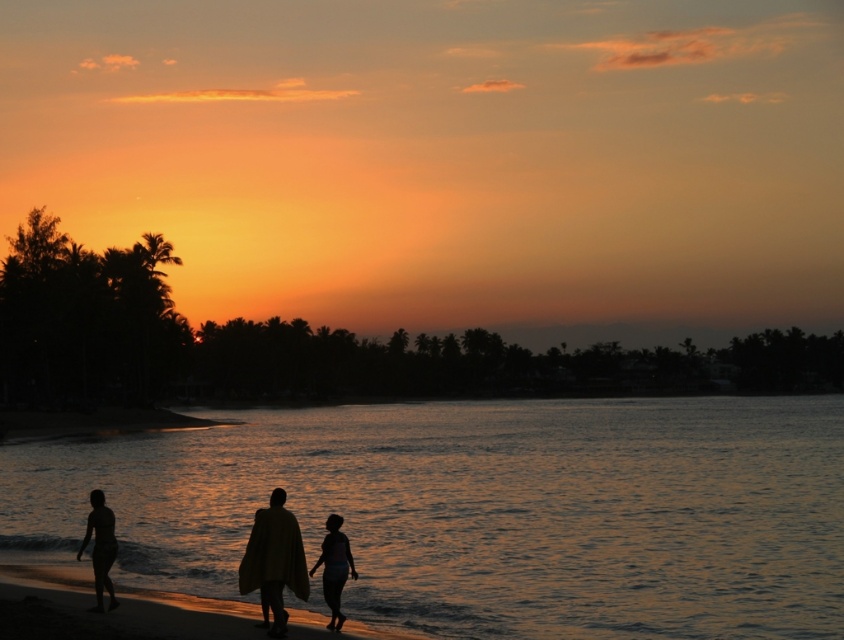
Question: Which point appears farthest from the camera in this image?

Choices:
 (A) (280, 563)
 (B) (90, 497)
 (C) (617, 552)

Answer: (C)

Question: Which point is farther to the camera?

Choices:
 (A) silhouette sand at lower left
 (B) glistening water at lower center

Answer: (B)

Question: Does glistening water at lower center have a smaller size compared to silhouette sand at lower left?

Choices:
 (A) yes
 (B) no

Answer: (B)

Question: Which point appears farthest from the camera in this image?

Choices:
 (A) (339, 588)
 (B) (277, 536)
 (C) (150, 467)

Answer: (C)

Question: From the image, what is the correct spatial relationship of glistening water at lower center in relation to silhouette skin at lower left?

Choices:
 (A) below
 (B) above

Answer: (B)

Question: Can you confirm if silhouette fabric at center is positioned below silhouette skin at lower left?

Choices:
 (A) no
 (B) yes

Answer: (A)